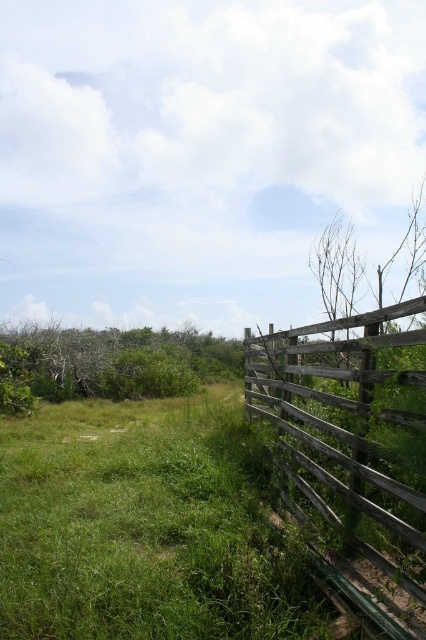
You are a gardener standing in the field and want to plant a new tree. You see the weathered wood fence at right and the green leafy bush at left. Which object is higher in the image?

The weathered wood fence at right is above the green leafy bush at left in the image.

You are standing in the middle of the field and see the weathered wood fence at right and the green leafy bush at left. Which object is positioned to the east if the fence is to the right of the bush?

The weathered wood fence at right is to the right of the green leafy bush at left, so if you are facing north, the fence would be east of the bush.

You are standing in the middle of the field and want to walk towards the weathered wood fence at right and the green leafy bush at left. Which object will you reach first?

You will reach the weathered wood fence at right first because it is closer to you than the green leafy bush at left.